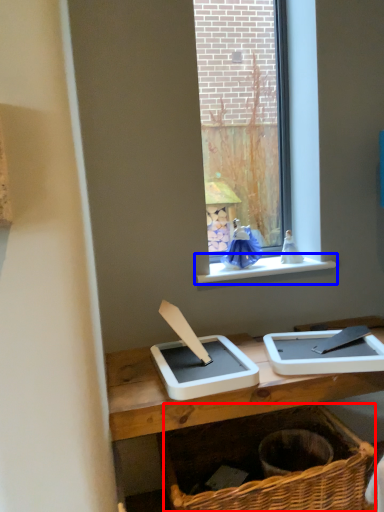
Question: Among these objects, which one is nearest to the camera, basket (highlighted by a red box) or window sill (highlighted by a blue box)?

Choices:
 (A) basket
 (B) window sill

Answer: (A)